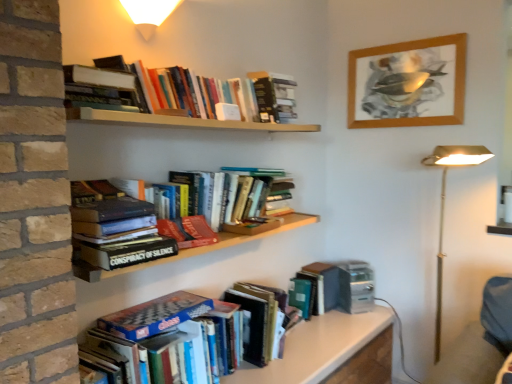
Question: Which direction should I rotate to look at blue glossy chess set at lower center, which is the 7th book from top to bottom?

Choices:
 (A) left
 (B) right

Answer: (A)

Question: Does matte white wall sconce at upper center contain hardcover book at center, which is counted as the 3th book, starting from the bottom?

Choices:
 (A) yes
 (B) no

Answer: (B)

Question: Is matte white wall sconce at upper center wider than hardcover book at center, the fifth book positioned from the top?

Choices:
 (A) yes
 (B) no

Answer: (A)

Question: Is matte white wall sconce at upper center taller than hardcover book at center, which is counted as the 3th book, starting from the bottom?

Choices:
 (A) no
 (B) yes

Answer: (B)

Question: From a real-world perspective, is matte white wall sconce at upper center positioned under hardcover book at center, the fifth book positioned from the top, based on gravity?

Choices:
 (A) no
 (B) yes

Answer: (A)

Question: Considering the relative positions of matte white wall sconce at upper center and hardcover book at center, the fifth book positioned from the top, in the image provided, is matte white wall sconce at upper center behind hardcover book at center, the fifth book positioned from the top,?

Choices:
 (A) yes
 (B) no

Answer: (B)

Question: Does matte white wall sconce at upper center lie in front of hardcover book at center, which is counted as the 3th book, starting from the bottom?

Choices:
 (A) no
 (B) yes

Answer: (B)

Question: Is hardcover book at upper center, which is counted as the 1th book, starting from the top, next to green matte book at lower center, arranged as the sixth book when viewed from the top, and touching it?

Choices:
 (A) yes
 (B) no

Answer: (B)

Question: Would you consider hardcover book at upper center, which is counted as the 1th book, starting from the top, to be distant from green matte book at lower center, which is counted as the second book, starting from the bottom?

Choices:
 (A) yes
 (B) no

Answer: (A)

Question: From a real-world perspective, is hardcover book at upper center, which is counted as the 1th book, starting from the top, physically above green matte book at lower center, arranged as the sixth book when viewed from the top?

Choices:
 (A) no
 (B) yes

Answer: (B)

Question: Is hardcover book at upper center, which appears as the 7th book when ordered from the bottom, at the left side of green matte book at lower center, which is counted as the second book, starting from the bottom?

Choices:
 (A) no
 (B) yes

Answer: (B)

Question: Considering the relative sizes of hardcover book at upper center, which appears as the 7th book when ordered from the bottom, and green matte book at lower center, arranged as the sixth book when viewed from the top, in the image provided, is hardcover book at upper center, which appears as the 7th book when ordered from the bottom, thinner than green matte book at lower center, arranged as the sixth book when viewed from the top,?

Choices:
 (A) yes
 (B) no

Answer: (A)

Question: Considering the relative positions of hardcover book at upper center, which is counted as the 1th book, starting from the top, and green matte book at lower center, arranged as the sixth book when viewed from the top, in the image provided, is hardcover book at upper center, which is counted as the 1th book, starting from the top, to the right of green matte book at lower center, arranged as the sixth book when viewed from the top, from the viewer's perspective?

Choices:
 (A) no
 (B) yes

Answer: (A)

Question: Considering the relative positions of hardcover book at upper left, the 3th book positioned from the top, and hardcover book at upper center, which appears as the 7th book when ordered from the bottom, in the image provided, is hardcover book at upper left, the 3th book positioned from the top, behind hardcover book at upper center, which appears as the 7th book when ordered from the bottom,?

Choices:
 (A) yes
 (B) no

Answer: (B)